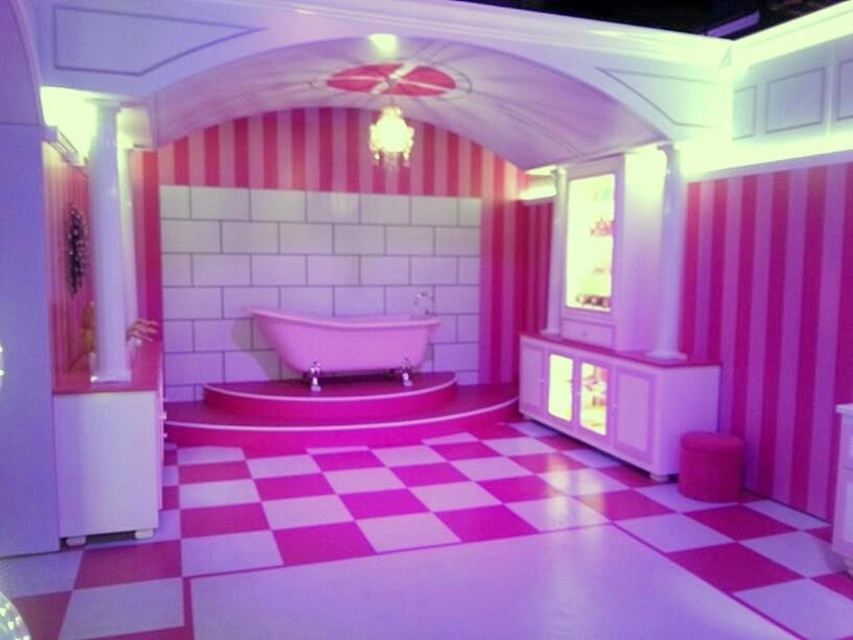
You are standing in the bathroom and want to reach the sink behind the white glossy column at left and the white glossy pillar at upper center. Which object do you need to move around to access the sink?

You need to move around the white glossy column at left because it is in front of the white glossy pillar at upper center, blocking the path to the sink.

You are standing in the bathroom and want to place a small decorative item between the two points labeled point (106, 148) and point (676, 314). Based on their positions, which point should the item be closer to?

The item should be closer to point (106, 148) because it is in front of point (676, 314), meaning it is closer to the observer.